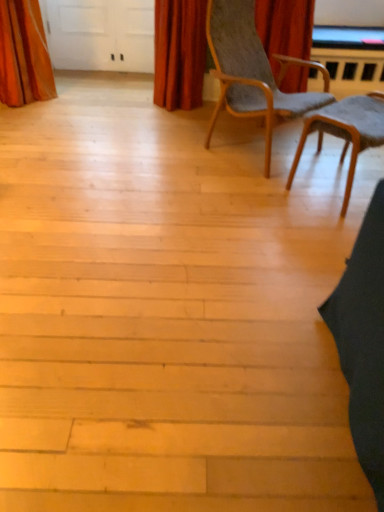
Locate an element on the screen. This screenshot has width=384, height=512. free spot to the left of light brown wood chair at center, marked as the first chair in a left-to-right arrangement is located at coordinates (149, 147).